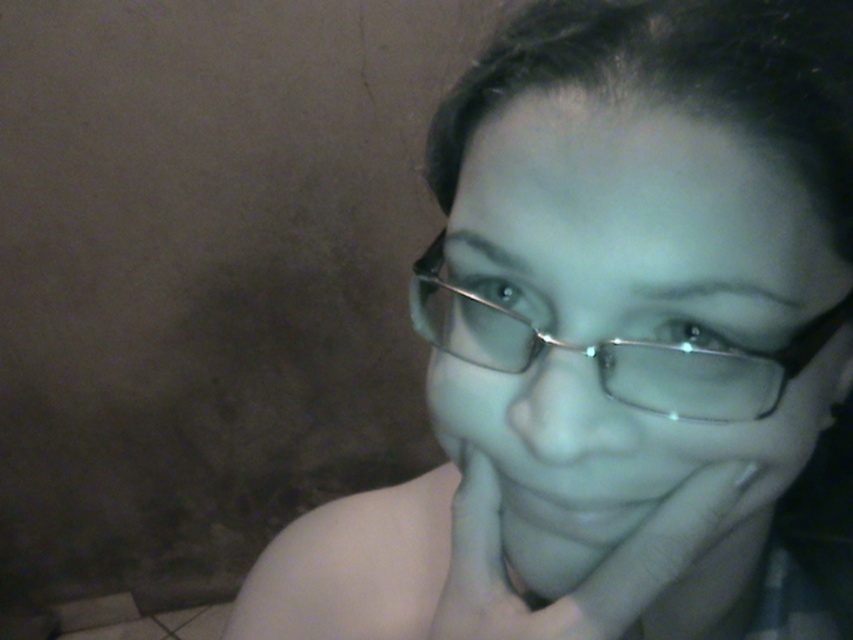
Which is in front, point (584, 561) or point (479, 346)?

Point (479, 346) is more forward.

Find the location of `clear plastic glasses at center`. clear plastic glasses at center is located at coordinates (637, 227).

Which is more to the left, clear plastic glasses at center or smooth skin hand at center?

Positioned to the left is clear plastic glasses at center.

Who is taller, clear plastic glasses at center or smooth skin hand at center?

clear plastic glasses at center

The image size is (853, 640). What are the coordinates of `clear plastic glasses at center` in the screenshot? It's located at (637, 227).

Find the location of a particular element. The height and width of the screenshot is (640, 853). smooth skin hand at center is located at coordinates (590, 572).

Who is more forward, (706,525) or (585,349)?

Point (585,349) is in front.

Who is more distant from viewer, (737,488) or (679,348)?

The point (737,488) is behind.

I want to click on smooth skin hand at center, so click(590, 572).